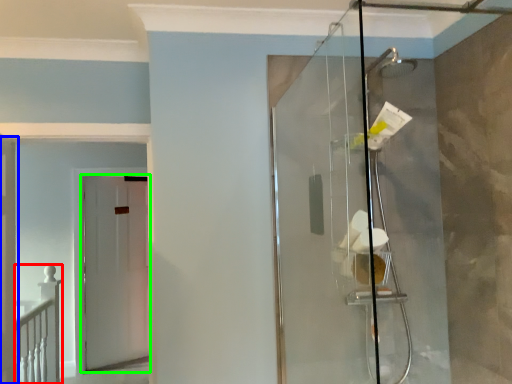
Question: Considering the real-world distances, which object is closest to rail (highlighted by a red box)? door (highlighted by a blue box) or door (highlighted by a green box).

Choices:
 (A) door
 (B) door

Answer: (A)